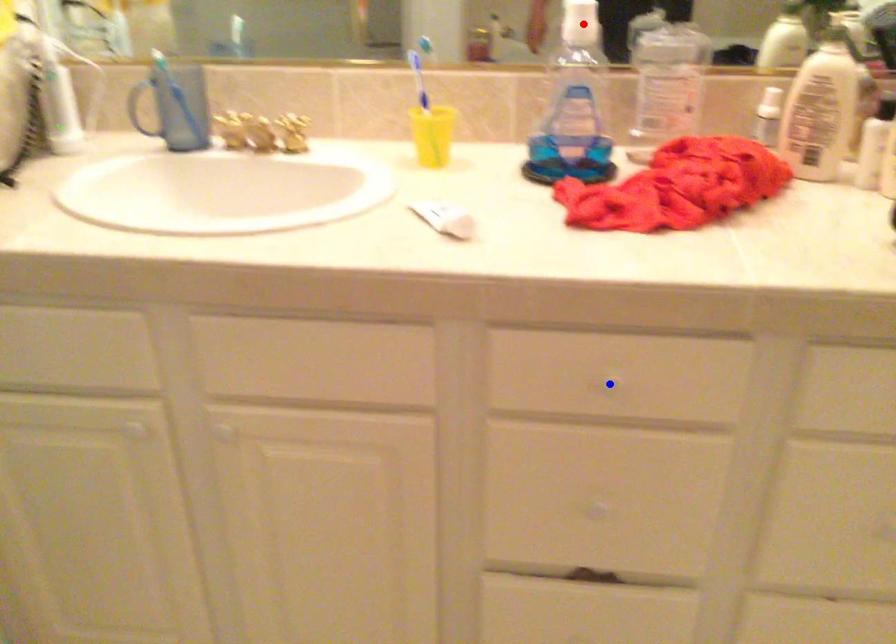
Question: In the image, two points are highlighted. Which point is nearer to the camera? Reply with the corresponding letter.

Choices:
 (A) blue point
 (B) red point

Answer: (A)